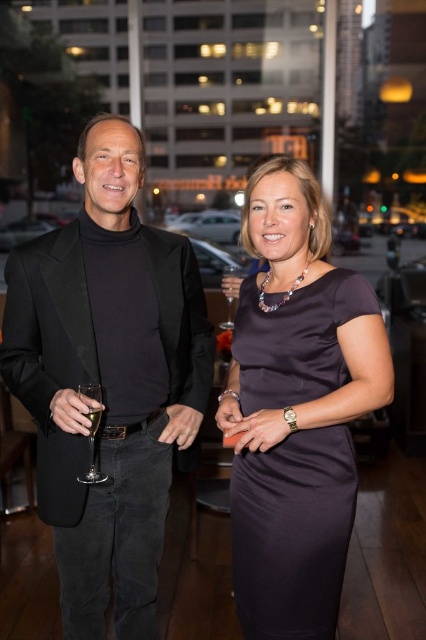
Question: Among these objects, which one is nearest to the camera?

Choices:
 (A) clear glass wine glass at center
 (B) clear glass wine glass at left
 (C) satin dress at center

Answer: (C)

Question: Is black satin suit at left smaller than clear glass wine glass at left?

Choices:
 (A) yes
 (B) no

Answer: (B)

Question: Can you confirm if black satin suit at left is positioned below clear glass wine glass at center?

Choices:
 (A) yes
 (B) no

Answer: (A)

Question: Can you confirm if clear glass wine glass at left is smaller than clear glass wine glass at center?

Choices:
 (A) no
 (B) yes

Answer: (B)

Question: Which object is the closest to the clear glass wine glass at left?

Choices:
 (A) clear glass wine at center
 (B) clear glass wine glass at center
 (C) black satin suit at left
 (D) satin dress at center

Answer: (A)

Question: Which of the following is the farthest from the observer?

Choices:
 (A) (334, 508)
 (B) (100, 417)
 (C) (89, 404)
 (D) (74, 253)

Answer: (D)